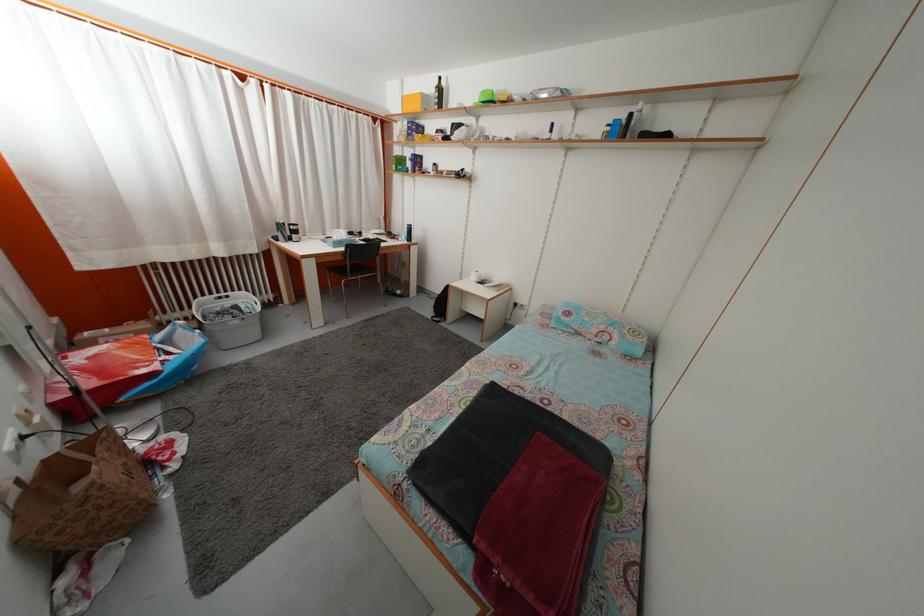
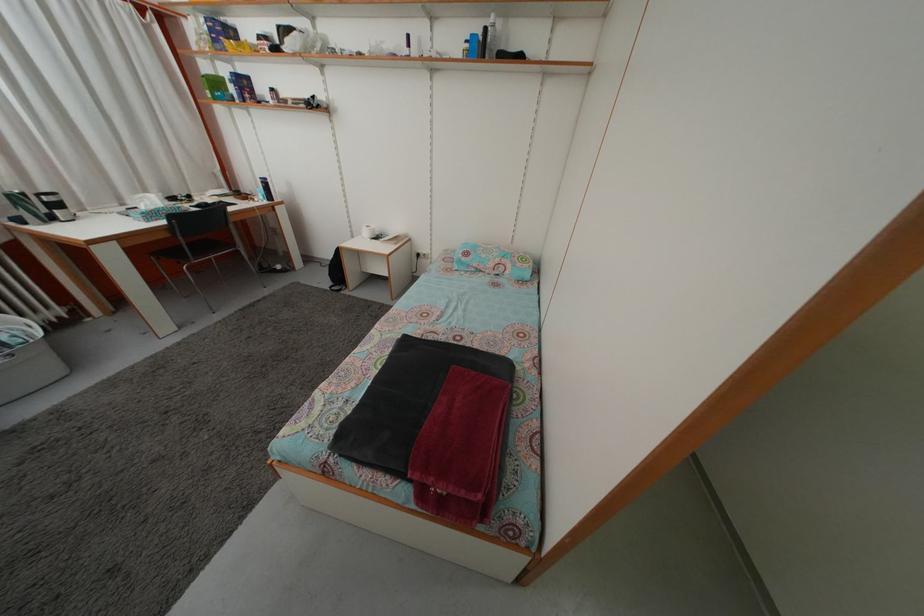
Find the pixel in the second image that matches pixel 614 136 in the first image.

(473, 53)